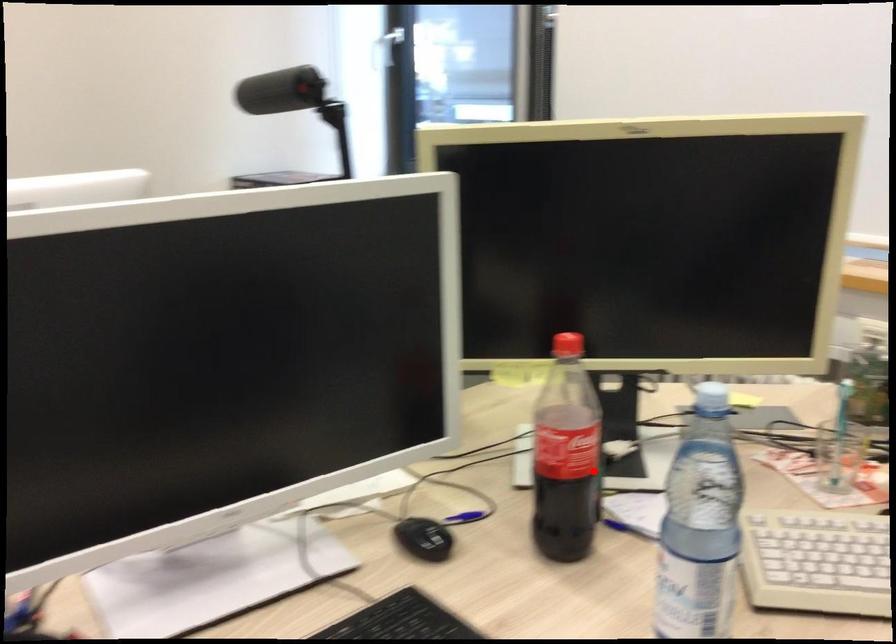
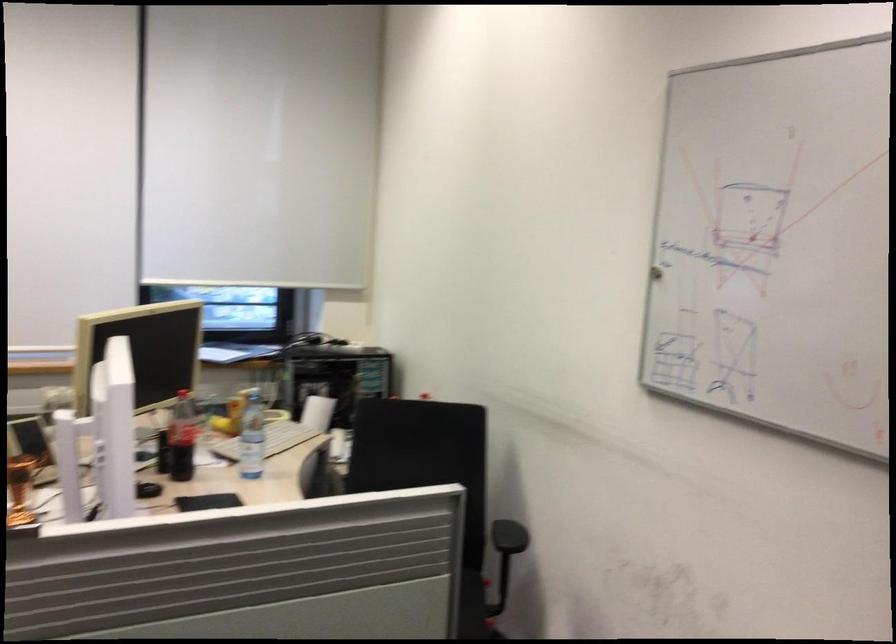
Question: I am providing you with two images of the same scene from different viewpoints. A red point is shown in image1. For the corresponding object point in image2, is it positioned nearer or farther from the camera?

Choices:
 (A) Nearer
 (B) Farther

Answer: (B)